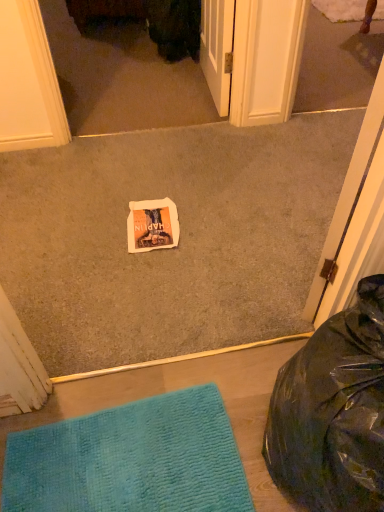
The image size is (384, 512). Find the location of `free space to the left of white paper at center`. free space to the left of white paper at center is located at coordinates (89, 236).